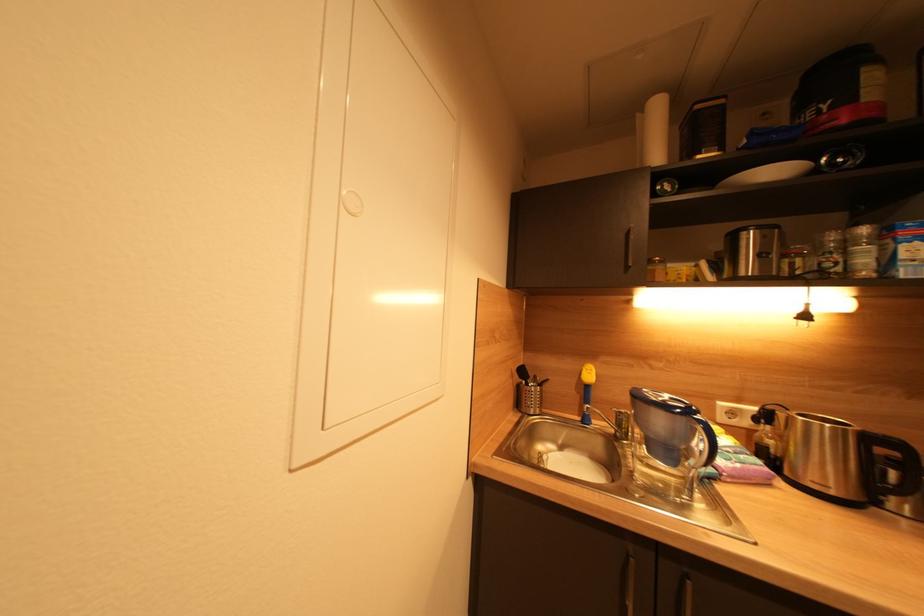
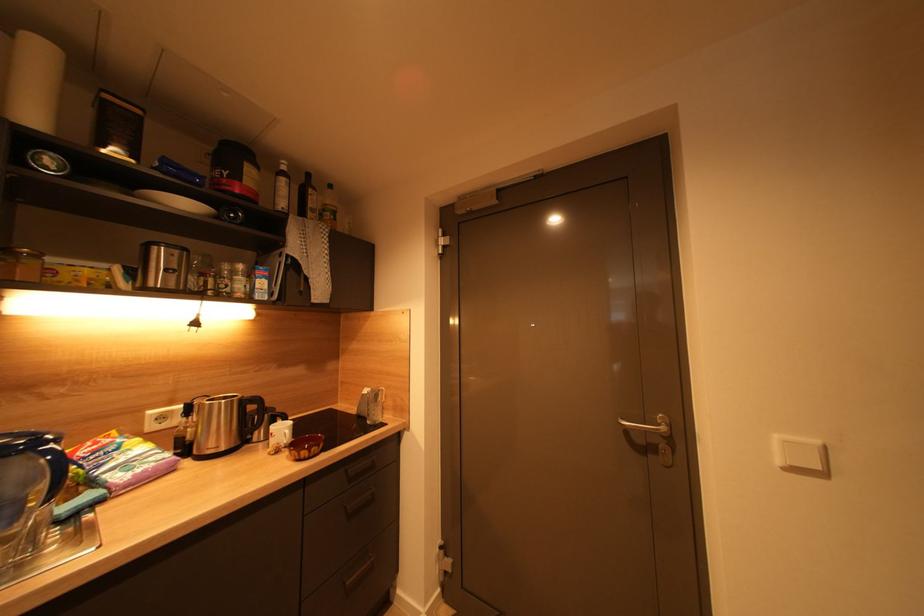
Question: The camera is either moving clockwise (left) or counter-clockwise (right) around the object. The first image is from the beginning of the video and the second image is from the end. Is the camera moving left or right when shooting the video?

Choices:
 (A) Left
 (B) Right

Answer: (A)